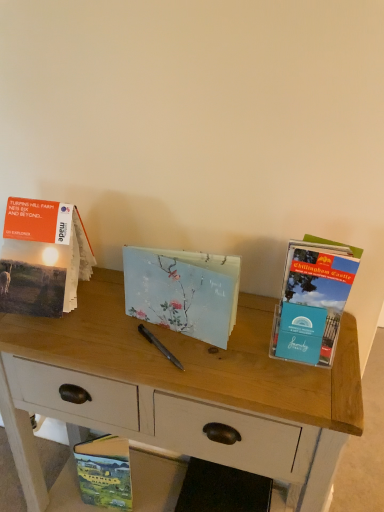
This screenshot has height=512, width=384. In order to click on free space that is in between blue cardstock brochure at right, the fourth book from the left, and light blue textured notebook at center, the 2th book when ordered from right to left in this screenshot , I will do `click(256, 344)`.